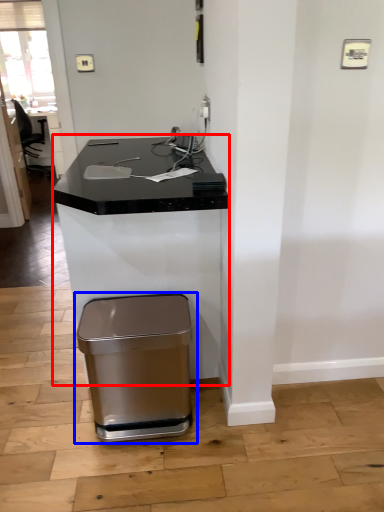
Question: Which point is further to the camera, computer desk (highlighted by a red box) or waste container (highlighted by a blue box)?

Choices:
 (A) computer desk
 (B) waste container

Answer: (B)